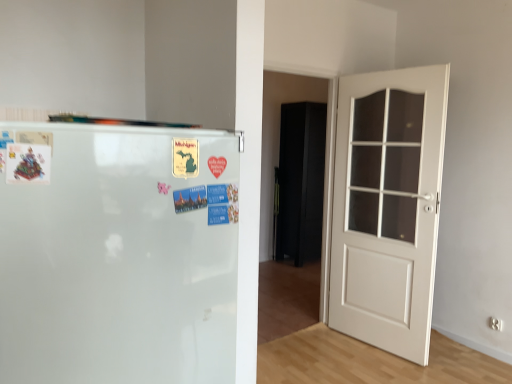
Question: Considering the positions of white glossy refrigerator at left and black matte armoire at center in the image, is white glossy refrigerator at left taller or shorter than black matte armoire at center?

Choices:
 (A) tall
 (B) short

Answer: (B)

Question: Is white glossy refrigerator at left bigger or smaller than black matte armoire at center?

Choices:
 (A) small
 (B) big

Answer: (B)

Question: Estimate the real-world distances between objects in this image. Which object is farther from the white glossy refrigerator at left?

Choices:
 (A) black matte armoire at center
 (B) white wooden door at right
 (C) clear glass door at right

Answer: (A)

Question: Estimate the real-world distances between objects in this image. Which object is closer to the white glossy refrigerator at left?

Choices:
 (A) clear glass door at right
 (B) black matte armoire at center
 (C) white wooden door at right

Answer: (C)